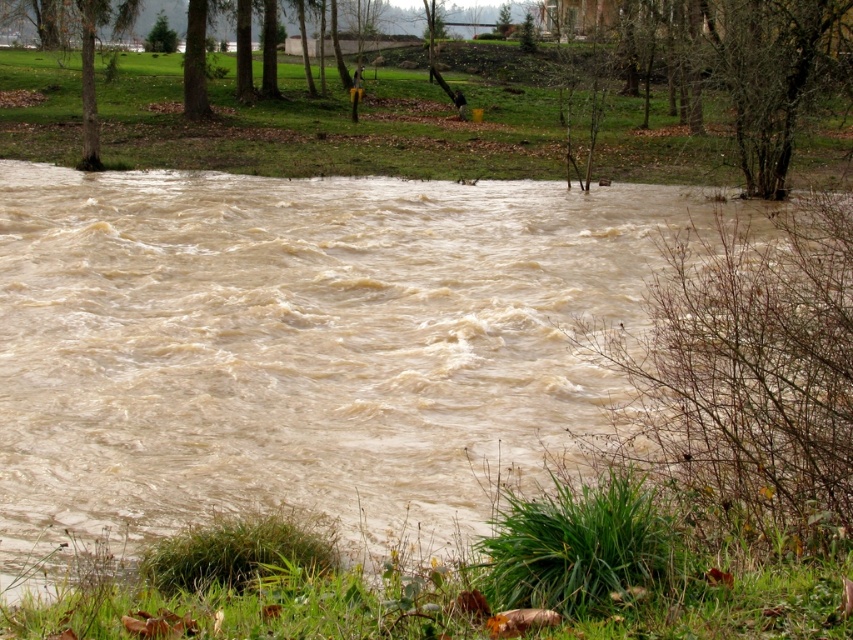
Question: Is the position of brown muddy water at center less distant than that of green matte tree at upper left?

Choices:
 (A) yes
 (B) no

Answer: (A)

Question: Is brown muddy water at center further to camera compared to green matte tree at upper left?

Choices:
 (A) no
 (B) yes

Answer: (A)

Question: Is brown muddy water at center below green matte tree at upper left?

Choices:
 (A) yes
 (B) no

Answer: (A)